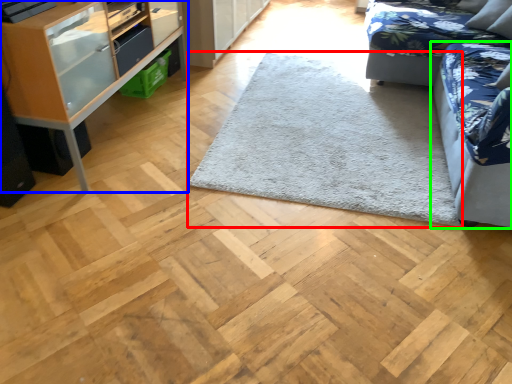
Question: Estimate the real-world distances between objects in this image. Which object is farther from mat (highlighted by a red box), shelf (highlighted by a blue box) or studio couch (highlighted by a green box)?

Choices:
 (A) shelf
 (B) studio couch

Answer: (A)